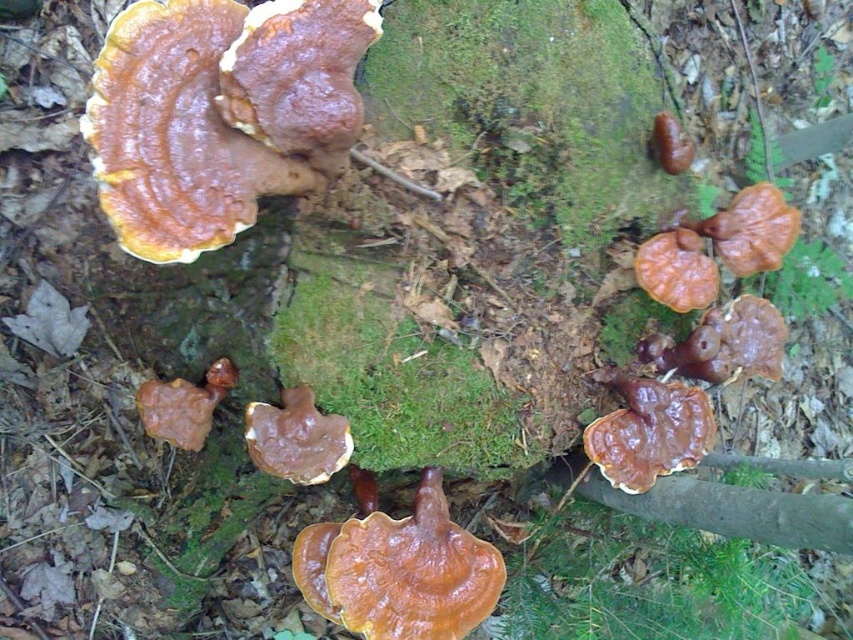
You are a mycologist examining the forest scene. You need to determine the relative positions of the brown matte mushroom at center and the brown leathery mushroom at lower right. Which mushroom is located to the left of the other?

The brown matte mushroom at center is positioned on the left side of brown leathery mushroom at lower right, so the brown matte mushroom at center is to the left of the brown leathery mushroom at lower right.

You are a mycologist examining two mushrooms in a forest. You notice the brown matte mushroom at center and the brown leathery mushroom at lower right. Which one is positioned lower on the tree trunk?

The brown matte mushroom at center is positioned lower on the tree trunk than the brown leathery mushroom at lower right.

You are a forager in the forest and need to collect both the brown matte fungus at center and the shiny orange bracket fungus at right. If your basket can only hold items within a 24 inch radius, will you be able to collect both without moving closer to them?

The brown matte fungus at center and the shiny orange bracket fungus at right are 24.51 inches apart, which exceeds the 24 inch radius of your basket. Therefore, you cannot collect both without moving closer to them.